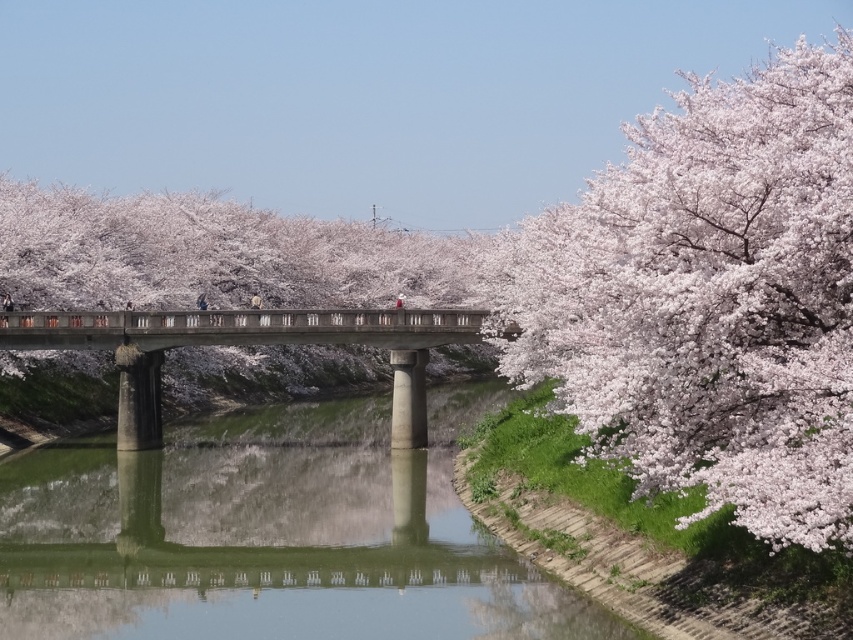
You are standing on the bridge and want to locate the green concrete river at center. According to the coordinates given, where should you look relative to the bridge?

The green concrete river at center is located at coordinates point (265, 550), so you should look towards the lower right area of the image relative to the bridge.

You are standing on the green concrete river at center and want to pick some pink blossoms at right. In which direction should you walk to reach them?

You should walk to the right because the pink blossoms at right are located to the right of the green concrete river at center.

You are standing at the point labeled point (532, 380) and want to walk to point (91, 326). Based on the scene, which direction should you move to get closer to your destination?

Since point (532, 380) is closer to the camera than point (91, 326), you should move away from the camera to reach point (91, 326).